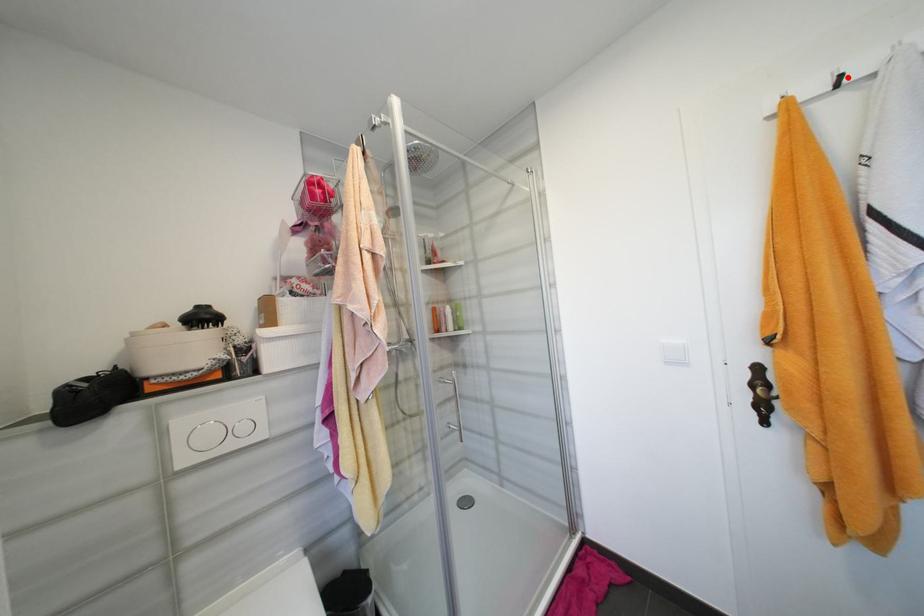
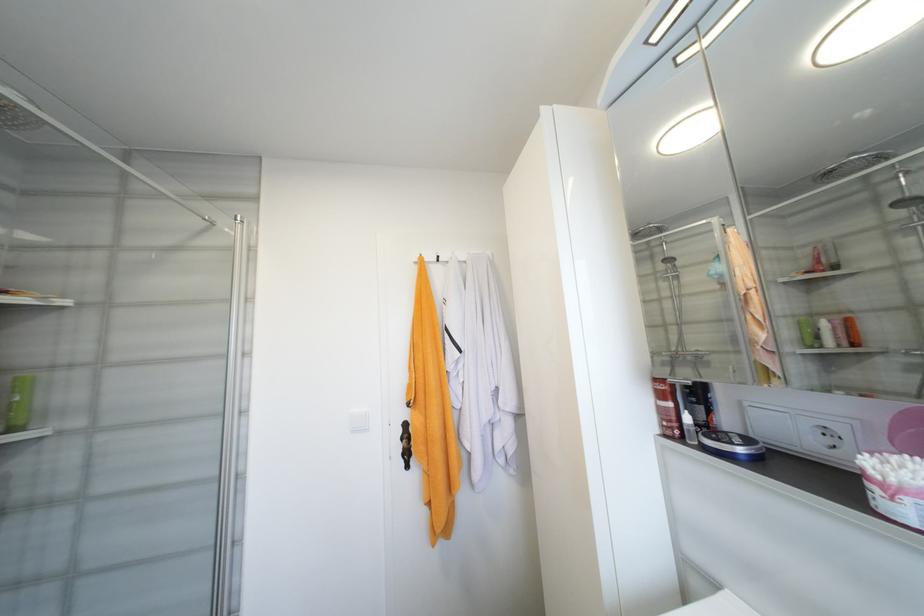
In the second image, find the point that corresponds to the highlighted location in the first image.

(444, 257)